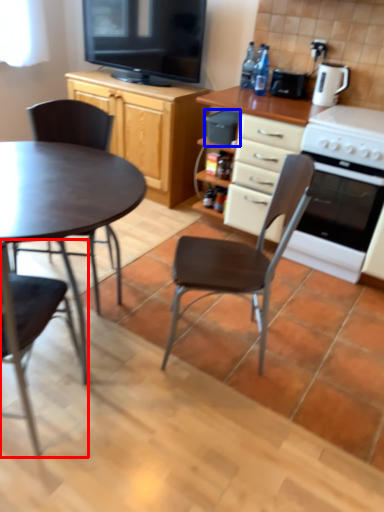
Question: Among these objects, which one is nearest to the camera, chair (highlighted by a red box) or appliance (highlighted by a blue box)?

Choices:
 (A) chair
 (B) appliance

Answer: (A)